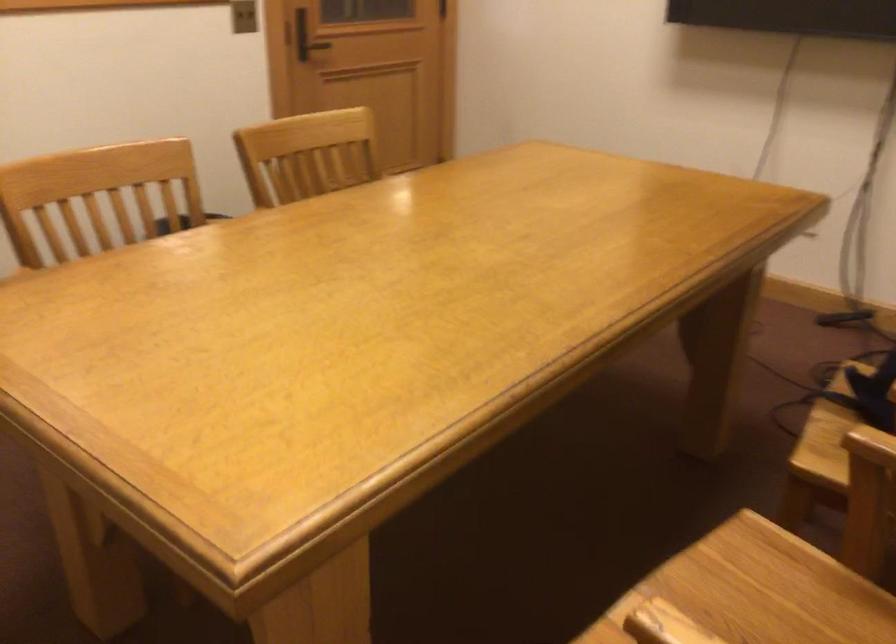
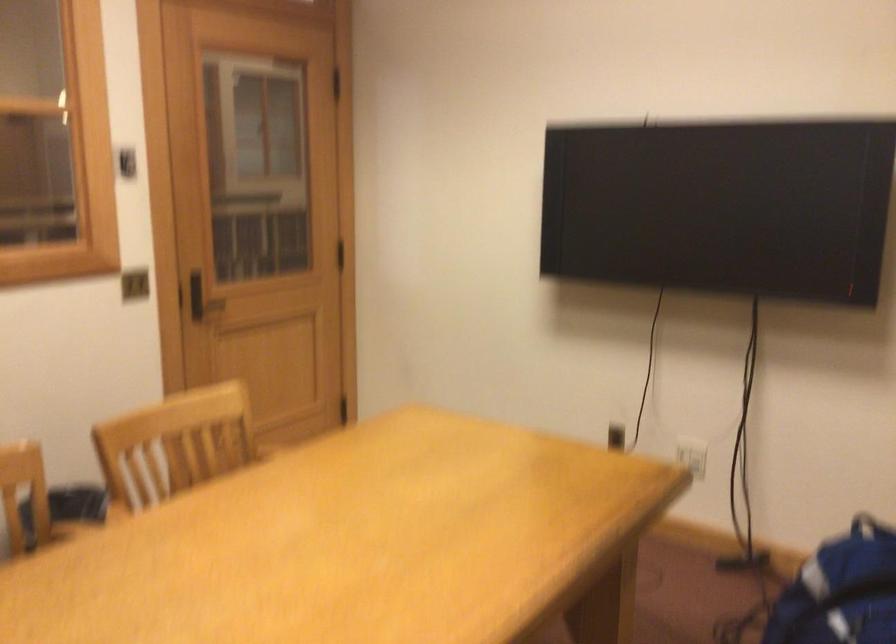
Question: What movement of the cameraman would produce the second image?

Choices:
 (A) Left
 (B) Right
 (C) Forward
 (D) Backward

Answer: (B)